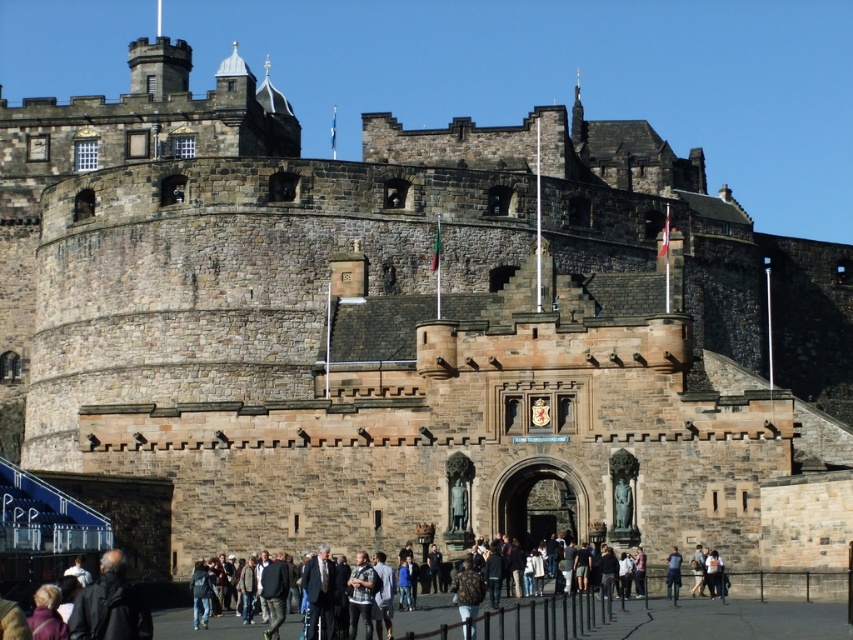
Who is more forward, (100, 604) or (679, 566)?

Positioned in front is point (100, 604).

Between dark brown leather jacket at lower left and dark blue jeans at lower center, which one is positioned higher?

dark brown leather jacket at lower left is higher up.

What are the coordinates of `dark brown leather jacket at lower left` in the screenshot? It's located at (109, 605).